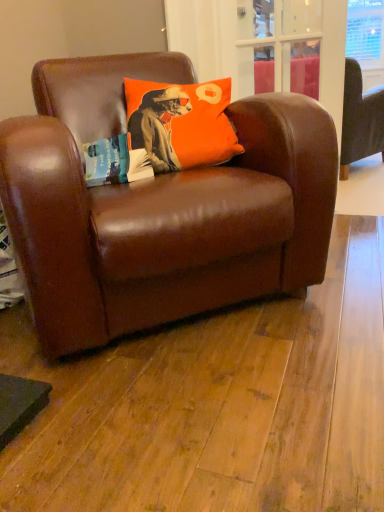
Question: Does orange matte pillow at upper center turn towards brown leather couch at upper right?

Choices:
 (A) no
 (B) yes

Answer: (A)

Question: Considering the relative sizes of orange matte pillow at upper center and brown leather couch at upper right in the image provided, is orange matte pillow at upper center bigger than brown leather couch at upper right?

Choices:
 (A) yes
 (B) no

Answer: (B)

Question: Is orange matte pillow at upper center next to brown leather couch at upper right and touching it?

Choices:
 (A) no
 (B) yes

Answer: (A)

Question: Considering the relative sizes of orange matte pillow at upper center and brown leather couch at upper right in the image provided, is orange matte pillow at upper center thinner than brown leather couch at upper right?

Choices:
 (A) no
 (B) yes

Answer: (B)

Question: Considering the relative sizes of orange matte pillow at upper center and brown leather couch at upper right in the image provided, is orange matte pillow at upper center taller than brown leather couch at upper right?

Choices:
 (A) no
 (B) yes

Answer: (A)

Question: Is brown leather chair at center situated inside brown leather couch at upper right or outside?

Choices:
 (A) inside
 (B) outside

Answer: (B)

Question: Considering the positions of brown leather chair at center and brown leather couch at upper right in the image, is brown leather chair at center taller or shorter than brown leather couch at upper right?

Choices:
 (A) tall
 (B) short

Answer: (B)

Question: Considering the positions of brown leather chair at center and brown leather couch at upper right in the image, is brown leather chair at center bigger or smaller than brown leather couch at upper right?

Choices:
 (A) small
 (B) big

Answer: (A)

Question: In the image, is brown leather chair at center on the left side or the right side of brown leather couch at upper right?

Choices:
 (A) left
 (B) right

Answer: (A)

Question: In terms of size, does orange matte pillow at upper center appear bigger or smaller than brown leather chair at center?

Choices:
 (A) big
 (B) small

Answer: (B)

Question: From a real-world perspective, relative to brown leather chair at center, is orange matte pillow at upper center vertically above or below?

Choices:
 (A) below
 (B) above

Answer: (B)

Question: From the image's perspective, relative to brown leather chair at center, is orange matte pillow at upper center above or below?

Choices:
 (A) above
 (B) below

Answer: (A)

Question: Is orange matte pillow at upper center in front of or behind brown leather chair at center in the image?

Choices:
 (A) behind
 (B) front

Answer: (A)

Question: From a real-world perspective, is brown leather chair at center positioned above or below orange matte pillow at upper center?

Choices:
 (A) above
 (B) below

Answer: (B)

Question: Is brown leather chair at center to the left or to the right of orange matte pillow at upper center in the image?

Choices:
 (A) left
 (B) right

Answer: (A)